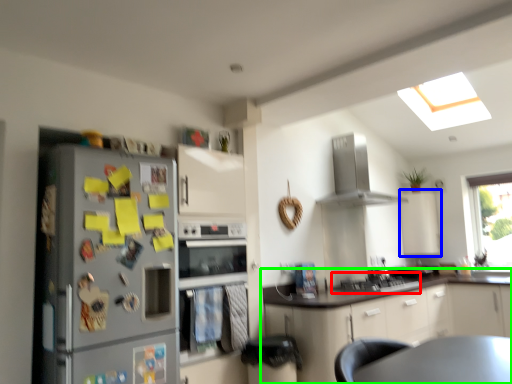
Question: Which is farther away from gas stove (highlighted by a red box)? cabinetry (highlighted by a blue box) or cabinetry (highlighted by a green box)?

Choices:
 (A) cabinetry
 (B) cabinetry

Answer: (A)